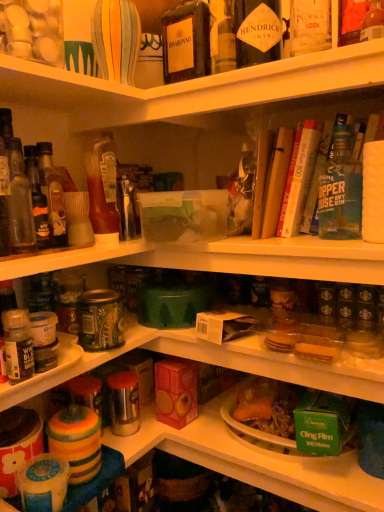
Question: In terms of width, does translucent glass bottle at upper left, the 3th bottle in the right-to-left sequence, look wider or thinner when compared to clear plastic container at upper center, acting as the first shelf starting from the right?

Choices:
 (A) thin
 (B) wide

Answer: (A)

Question: Looking at the image, does translucent glass bottle at upper left, the fifth bottle positioned from the left, seem bigger or smaller compared to clear plastic container at upper center, marked as the second shelf in a left-to-right arrangement?

Choices:
 (A) small
 (B) big

Answer: (A)

Question: Which is nearer to the dark brown glass bottle at upper center, which ranks as the second bottle in right-to-left order?

Choices:
 (A) green matte bottle at upper right, the 1th bottle viewed from the right
 (B) hardcover book at upper right, the 3th book positioned from the left
 (C) clear plastic container at upper center, positioned as the 2th shelf in bottom-to-top order
 (D) translucent glass bottle at upper left, the 3th bottle in the right-to-left sequence
 (E) translucent glass bottle at left, the 1th bottle in the left-to-right sequence

Answer: (C)

Question: Estimate the real-world distances between objects in this image. Which object is closer to the green matte bottle at upper right, the 1th bottle viewed from the right?

Choices:
 (A) metallic silver canister at left, the first shelf from the bottom
 (B) hardcover book at upper right, the 2th book in the right-to-left sequence
 (C) translucent glass bottle at left, the 1th bottle in the left-to-right sequence
 (D) yellow paperback book at upper right, marked as the 3th book in a right-to-left arrangement
 (E) clear plastic container at upper center, positioned as the 2th shelf in bottom-to-top order

Answer: (B)